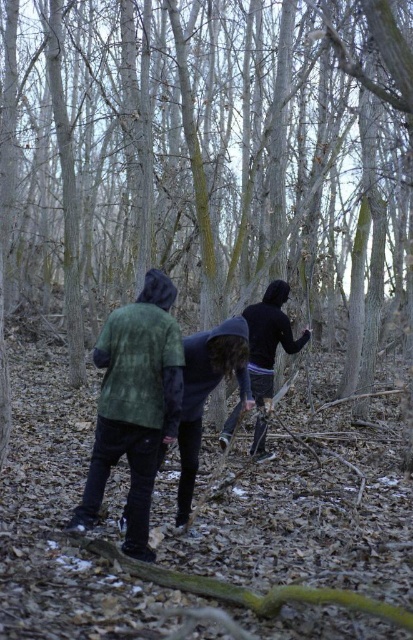
Between green corduroy jacket at left and black matte jacket at center, which one is positioned higher?

black matte jacket at center

Between green corduroy jacket at left and black matte jacket at center, which one is positioned lower?

Positioned lower is green corduroy jacket at left.

Is point (151, 436) closer to camera compared to point (256, 346)?

That is True.

This screenshot has height=640, width=413. What are the coordinates of `green corduroy jacket at left` in the screenshot? It's located at (135, 404).

Does green flannel shirt at center come behind black matte jacket at center?

No, it is not.

Is green flannel shirt at center smaller than black matte jacket at center?

No.

Is point (102, 346) farther from viewer compared to point (266, 358)?

That is False.

Find the location of a particular element. green flannel shirt at center is located at coordinates (121, 440).

Between green flannel shirt at center and green corduroy jacket at left, which one appears on the right side from the viewer's perspective?

green flannel shirt at center is more to the right.

Is point (111, 442) farther from camera compared to point (132, 412)?

Yes, point (111, 442) is behind point (132, 412).

Image resolution: width=413 pixels, height=640 pixels. What do you see at coordinates (121, 440) in the screenshot? I see `green flannel shirt at center` at bounding box center [121, 440].

What are the coordinates of `green flannel shirt at center` in the screenshot? It's located at (121, 440).